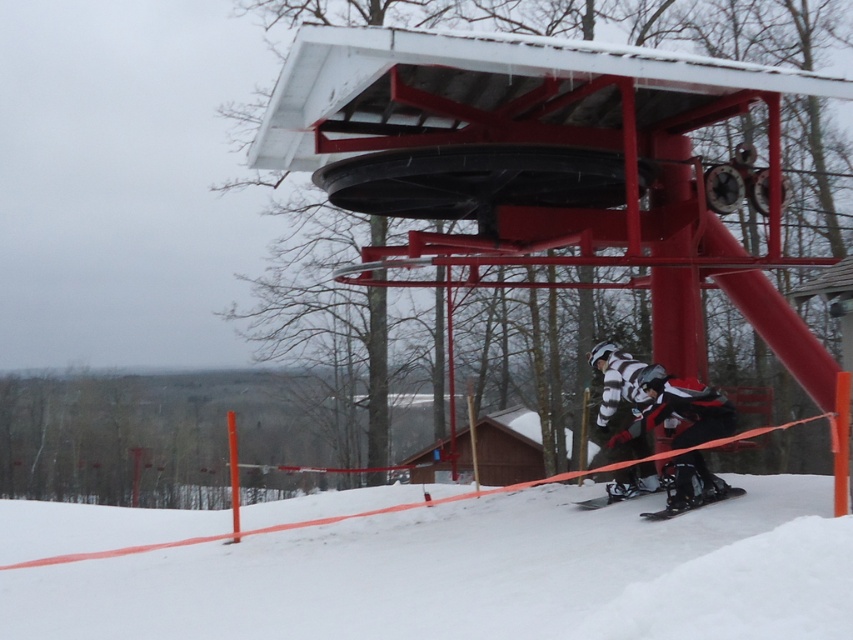
What do you see at coordinates (618, 380) in the screenshot? This screenshot has width=853, height=640. I see `striped fabric snowsuit at center` at bounding box center [618, 380].

Is striped fabric snowsuit at center above black matte snowboard at lower center?

Indeed, striped fabric snowsuit at center is positioned over black matte snowboard at lower center.

Locate an element on the screen. Image resolution: width=853 pixels, height=640 pixels. striped fabric snowsuit at center is located at coordinates (618, 380).

The height and width of the screenshot is (640, 853). What are the coordinates of `striped fabric snowsuit at center` in the screenshot? It's located at (618, 380).

Does striped fabric snowsuit at center have a lesser width compared to shiny black ski at lower center?

Yes, striped fabric snowsuit at center is thinner than shiny black ski at lower center.

Consider the image. Does striped fabric snowsuit at center have a larger size compared to shiny black ski at lower center?

Indeed, striped fabric snowsuit at center has a larger size compared to shiny black ski at lower center.

Is point (637, 401) behind point (596, 506)?

Yes, it is.

Identify the location of striped fabric snowsuit at center. (618, 380).

Can you confirm if white powdery snow at lower center is bigger than white matte ski suit at center?

Yes.

Between white powdery snow at lower center and white matte ski suit at center, which one appears on the right side from the viewer's perspective?

Positioned to the right is white matte ski suit at center.

Does point (746, 586) lie behind point (712, 497)?

That is False.

The width and height of the screenshot is (853, 640). In order to click on white powdery snow at lower center in this screenshot , I will do [477, 573].